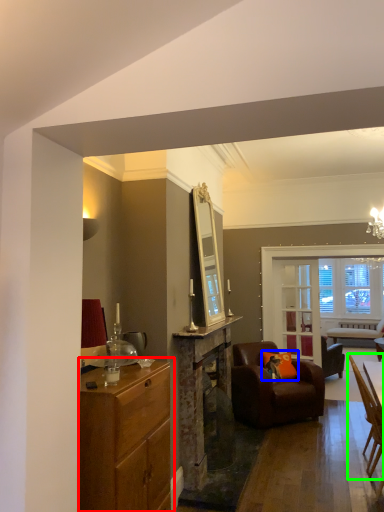
Question: Which is farther away from cabinetry (highlighted by a red box)? pillow (highlighted by a blue box) or chair (highlighted by a green box)?

Choices:
 (A) pillow
 (B) chair

Answer: (A)